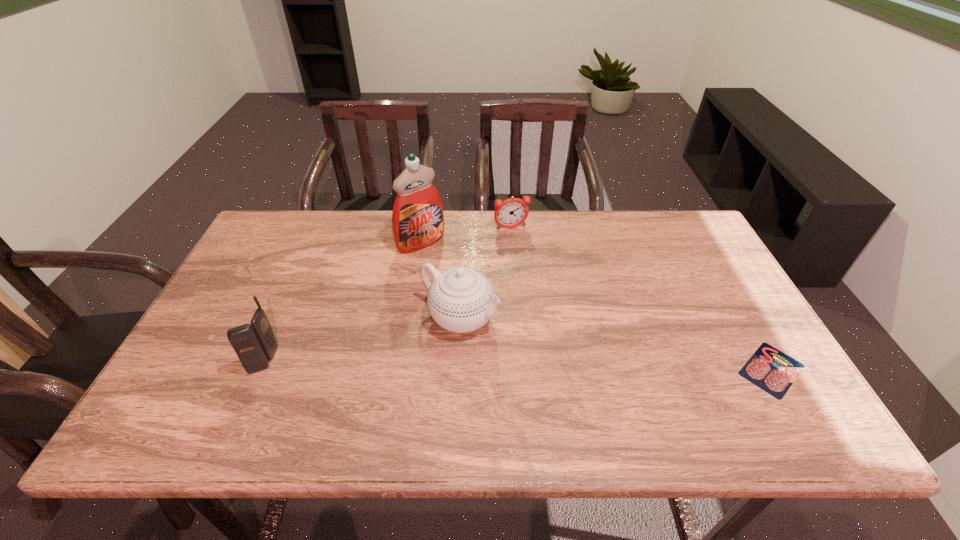
In the image, there is a desktop. Identify the location of vacant space at the far right corner. (659, 251).

Where is `free area in between the leftmost object and the second shortest object`? free area in between the leftmost object and the second shortest object is located at coordinates (388, 294).

Where is `empty space between the leftmost object and the second shortest object`? Image resolution: width=960 pixels, height=540 pixels. empty space between the leftmost object and the second shortest object is located at coordinates (388, 294).

Where is `free spot between the chinaware and the rightmost object`? The width and height of the screenshot is (960, 540). free spot between the chinaware and the rightmost object is located at coordinates (615, 343).

What are the coordinates of `blank region between the salami and the detergent` in the screenshot? It's located at (596, 306).

Identify the location of free space between the detergent and the second shortest object. This screenshot has width=960, height=540. (467, 235).

The width and height of the screenshot is (960, 540). I want to click on vacant space that is in between the chinaware and the rightmost object, so point(615,343).

Where is `vacant region between the leftmost object and the tallest object`? vacant region between the leftmost object and the tallest object is located at coordinates tap(343, 301).

At what (x,y) coordinates should I click in order to perform the action: click on vacant area between the chinaware and the alarm clock. Please return your answer as a coordinate pair (x, y). Looking at the image, I should click on (486, 273).

Find the location of a particular element. Image resolution: width=960 pixels, height=540 pixels. unoccupied area between the cellular telephone and the chinaware is located at coordinates (362, 339).